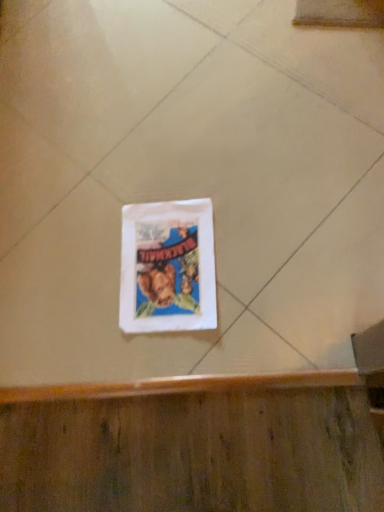
The height and width of the screenshot is (512, 384). I want to click on free region under white paper bag at center (from a real-world perspective), so click(168, 266).